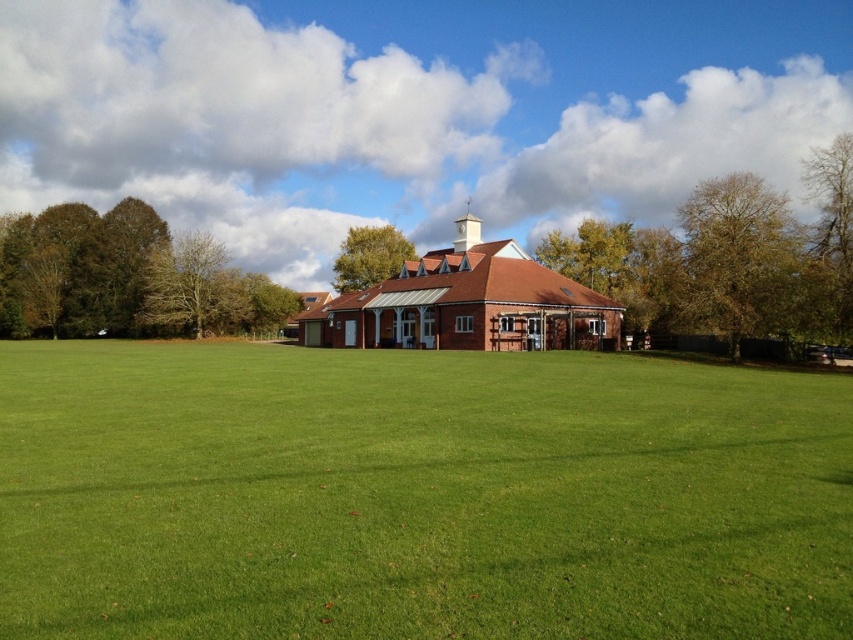
Question: Can you confirm if brown textured tree at center is smaller than green leafy tree at center?

Choices:
 (A) no
 (B) yes

Answer: (A)

Question: Among these points, which one is farthest from the camera?

Choices:
 (A) (80, 336)
 (B) (815, 248)
 (C) (198, 308)
 (D) (795, 227)

Answer: (A)

Question: Is green grass at center further to the viewer compared to brown leafy tree at left?

Choices:
 (A) no
 (B) yes

Answer: (A)

Question: Does brown leafy tree at upper right have a lesser width compared to green leafy tree at left?

Choices:
 (A) no
 (B) yes

Answer: (A)

Question: Which point is farther from the camera taking this photo?

Choices:
 (A) (165, 268)
 (B) (776, 326)

Answer: (A)

Question: Which point is farther from the camera taking this photo?

Choices:
 (A) (352, 289)
 (B) (788, 212)

Answer: (A)